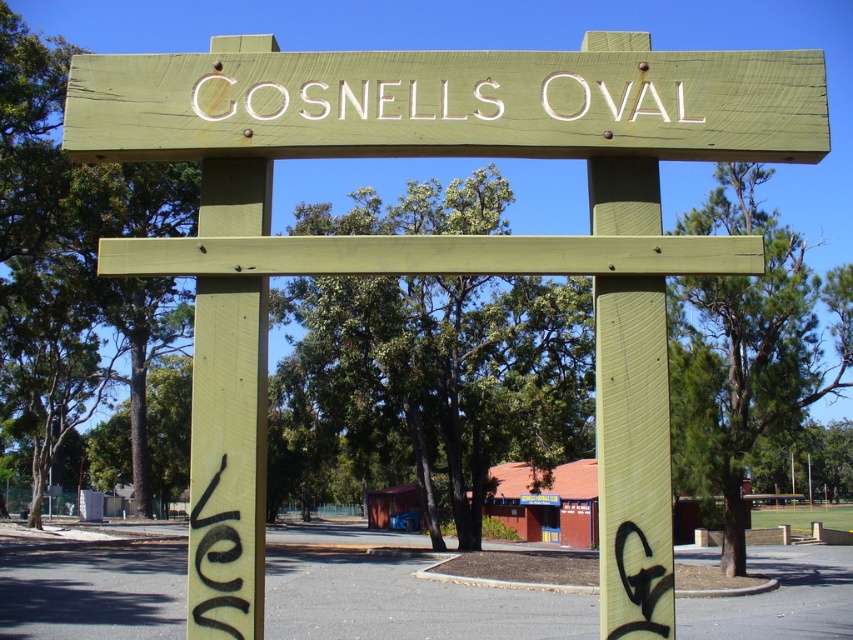
Question: Does green wood sign at center have a larger size compared to white painted wood sign at center?

Choices:
 (A) yes
 (B) no

Answer: (A)

Question: From the image, what is the correct spatial relationship of green wood sign at center in relation to white painted wood sign at center?

Choices:
 (A) below
 (B) above

Answer: (B)

Question: Does green wood sign at center have a smaller size compared to white painted wood sign at center?

Choices:
 (A) no
 (B) yes

Answer: (A)

Question: Which point is farther from the camera taking this photo?

Choices:
 (A) (366, 97)
 (B) (480, 125)

Answer: (A)

Question: Which object is farther from the camera taking this photo?

Choices:
 (A) white painted wood sign at center
 (B) green wood sign at center

Answer: (A)